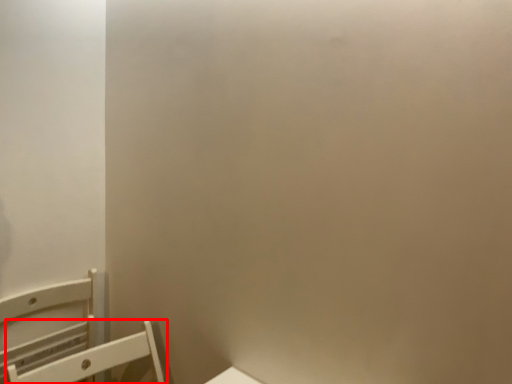
Question: Observing the image, what is the correct spatial positioning of furniture (annotated by the red box) in reference to furniture?

Choices:
 (A) right
 (B) left

Answer: (A)